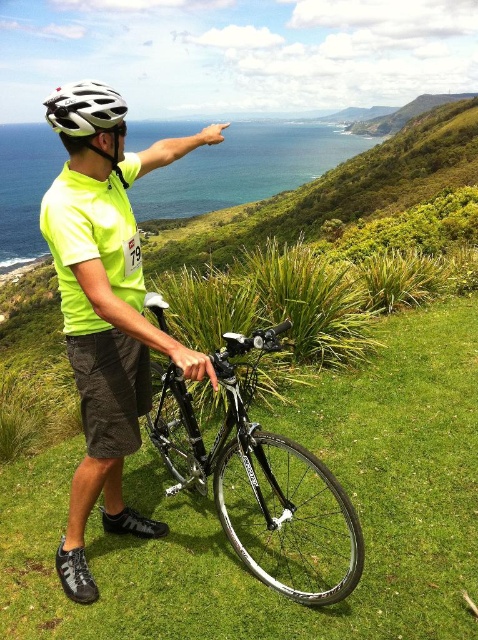
Does neon yellow shirt at center have a larger size compared to shiny black bicycle at center?

Yes.

Who is more distant from viewer, (x=112, y=404) or (x=245, y=563)?

Positioned behind is point (x=245, y=563).

Where is `neon yellow shirt at center`? neon yellow shirt at center is located at coordinates (106, 305).

Is neon yellow shirt at center closer to camera compared to white matte bicycle helmet at upper center?

Yes, neon yellow shirt at center is in front of white matte bicycle helmet at upper center.

Can you confirm if neon yellow shirt at center is wider than white matte bicycle helmet at upper center?

Correct, the width of neon yellow shirt at center exceeds that of white matte bicycle helmet at upper center.

Locate an element on the screen. The height and width of the screenshot is (640, 478). neon yellow shirt at center is located at coordinates [x=106, y=305].

Measure the distance between green grassy at center and camera.

green grassy at center is 2.91 meters from camera.

Find the location of `green grassy at center`. green grassy at center is located at coordinates (412, 452).

This screenshot has width=478, height=640. In order to click on green grassy at center in this screenshot , I will do `click(412, 452)`.